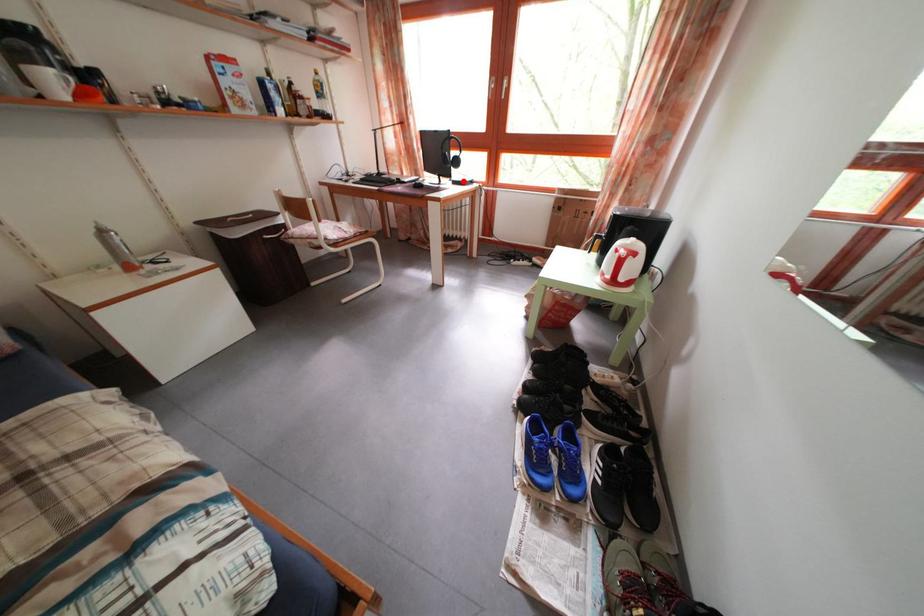
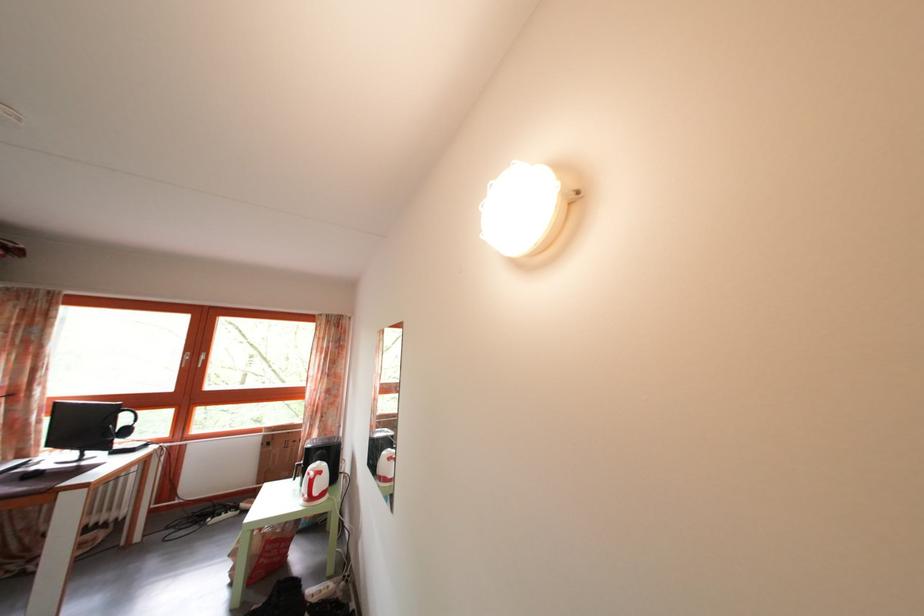
Question: I am providing you with two images of the same scene from different viewpoints. Image1 has a red point marked. In image2, the corresponding 3D location appears at what relative position? Reply with the corresponding letter.

Choices:
 (A) Closer
 (B) Farther

Answer: (B)